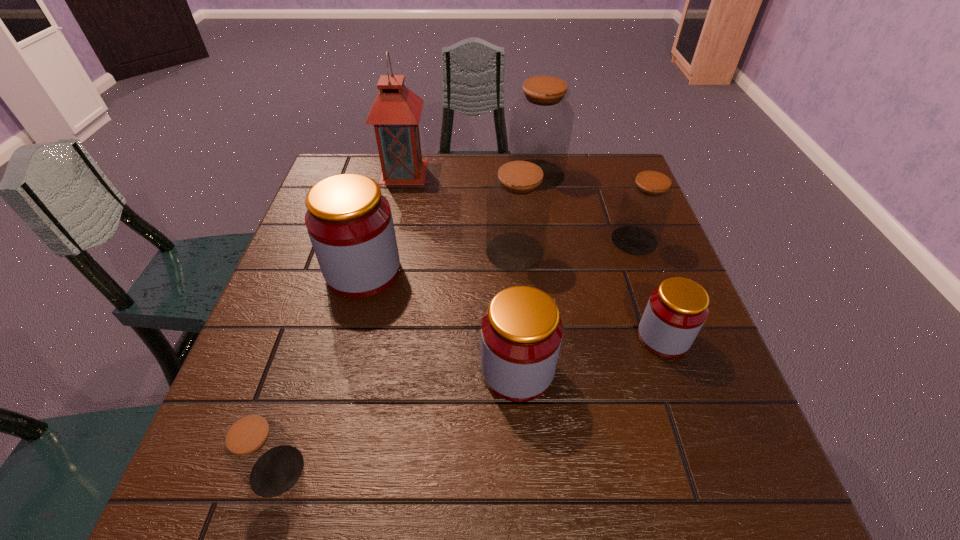
I want to click on lantern that is at the far edge, so click(395, 113).

The image size is (960, 540). In order to click on jar situated at the far edge in this screenshot , I will do `click(541, 121)`.

At what (x,y) coordinates should I click in order to perform the action: click on object located at the near edge. Please return your answer as a coordinate pair (x, y). Looking at the image, I should click on (259, 450).

This screenshot has height=540, width=960. Identify the location of lantern at the left edge. (395, 113).

Where is `object that is at the far left corner`? This screenshot has height=540, width=960. object that is at the far left corner is located at coordinates (395, 113).

Locate an element on the screen. object at the near left corner is located at coordinates (259, 450).

Where is `vacant point at the far edge`? This screenshot has width=960, height=540. vacant point at the far edge is located at coordinates (429, 177).

This screenshot has height=540, width=960. Find the location of `free space at the left edge of the desktop`. free space at the left edge of the desktop is located at coordinates (320, 319).

In the image, there is a desktop. At what (x,y) coordinates should I click in order to perform the action: click on free space at the right edge. Please return your answer as a coordinate pair (x, y). The image size is (960, 540). Looking at the image, I should click on (617, 248).

Identify the location of vacant space at the far left corner of the desktop. (348, 160).